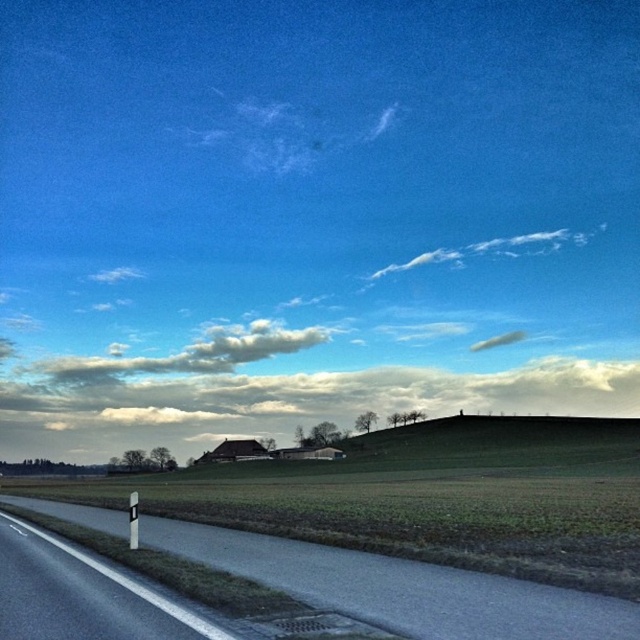
You are driving a car and see the asphalt road at lower left and the white glossy signpost at lower left. Which object is nearer to you?

The asphalt road at lower left is closer to the viewer than the white glossy signpost at lower left.

You are a drone operator planning to fly a drone from the asphalt road at lower left to the white fluffy cloud at upper center. Given that the drone has a maximum flight range of 700 feet, will it be able to reach the cloud without needing to recharge?

The asphalt road at lower left and white fluffy cloud at upper center are 694.64 feet apart. Since the distance is less than the drone s 700 feet range, the drone can reach the cloud without needing to recharge.

You are standing at the center of the road in the image. If you walk straight ahead along the road, will the white glossy signpost at lower left come into your view before you reach the hill?

The white glossy signpost at lower left is located at point (x=93, y=595), which is positioned to the left side of the road near its starting point. Since the road curves slightly towards the left and the signpost is at the lower left, it would likely come into view as you start walking along the road. However, the exact visibility depends on the curvature and any obstructions. Based on the given coordinates, the signpost is placed near the beginning of the road, so it should be visible before reaching the